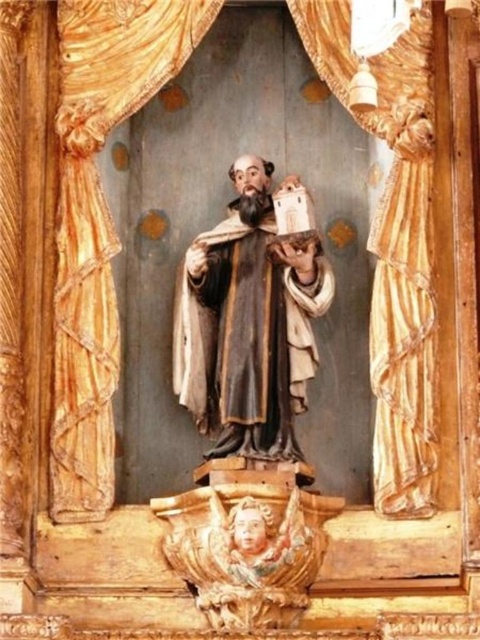
This screenshot has width=480, height=640. Describe the element at coordinates (98, 221) in the screenshot. I see `wooden at left` at that location.

Who is higher up, wooden at left or carved wood cherub at lower center?

wooden at left is higher up.

Locate an element on the screen. The height and width of the screenshot is (640, 480). wooden at left is located at coordinates (98, 221).

The height and width of the screenshot is (640, 480). What do you see at coordinates (247, 336) in the screenshot?
I see `matte brown robe at center` at bounding box center [247, 336].

Is matte brown robe at center below carved wood cherub at lower center?

Incorrect, matte brown robe at center is not positioned below carved wood cherub at lower center.

Locate an element on the screen. matte brown robe at center is located at coordinates (247, 336).

What do you see at coordinates (404, 282) in the screenshot? This screenshot has width=480, height=640. I see `gold textured curtain at center` at bounding box center [404, 282].

Is gold textured curtain at center taller than carved wood cherub at lower center?

Correct, gold textured curtain at center is much taller as carved wood cherub at lower center.

Is point (384, 116) closer to viewer compared to point (310, 540)?

No, it is not.

Find the location of `gold textured curtain at center`. gold textured curtain at center is located at coordinates (404, 282).